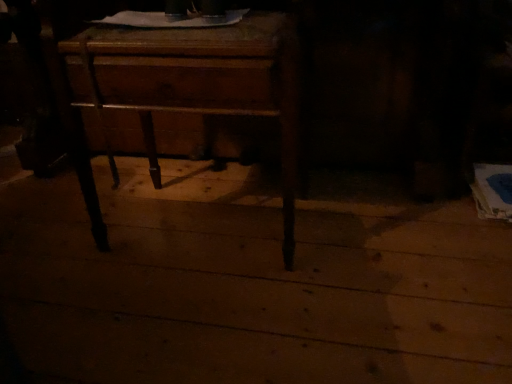
The image size is (512, 384). Identify the location of free area below wooden drawer at center (from a real-world perspective). (199, 231).